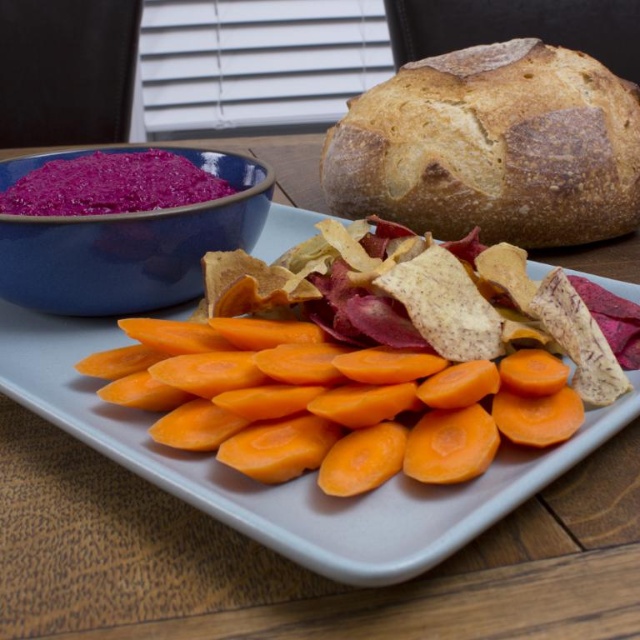
Question: Observing the image, what is the correct spatial positioning of golden brown crusty loaf at upper right in reference to purple matte bowl at upper left?

Choices:
 (A) below
 (B) above

Answer: (B)

Question: Where is orange smooth carrot at center located in relation to orange matte carrot slices at center in the image?

Choices:
 (A) right
 (B) left

Answer: (B)

Question: Among these objects, which one is nearest to the camera?

Choices:
 (A) orange smooth carrot at center
 (B) purple matte bowl at upper left
 (C) golden brown crusty loaf at upper right
 (D) orange matte carrot slices at center

Answer: (D)

Question: Among these objects, which one is farthest from the camera?

Choices:
 (A) golden brown crusty loaf at upper right
 (B) orange smooth carrot at center

Answer: (A)

Question: Can you confirm if orange smooth carrot at center is positioned above purple matte bowl at upper left?

Choices:
 (A) yes
 (B) no

Answer: (B)

Question: Which of the following is the closest to the observer?

Choices:
 (A) orange matte carrot slices at center
 (B) orange smooth carrot at center
 (C) purple matte bowl at upper left

Answer: (A)